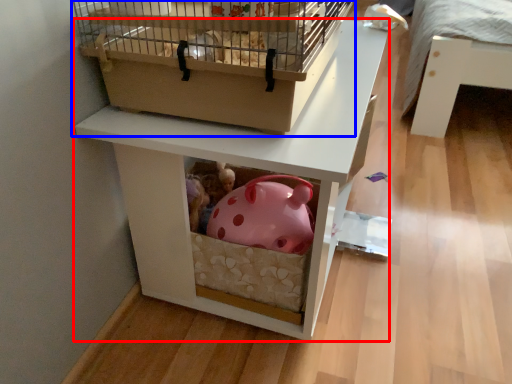
Question: Which of the following is the closest to the observer, furniture (highlighted by a red box) or bird cage (highlighted by a blue box)?

Choices:
 (A) furniture
 (B) bird cage

Answer: (B)